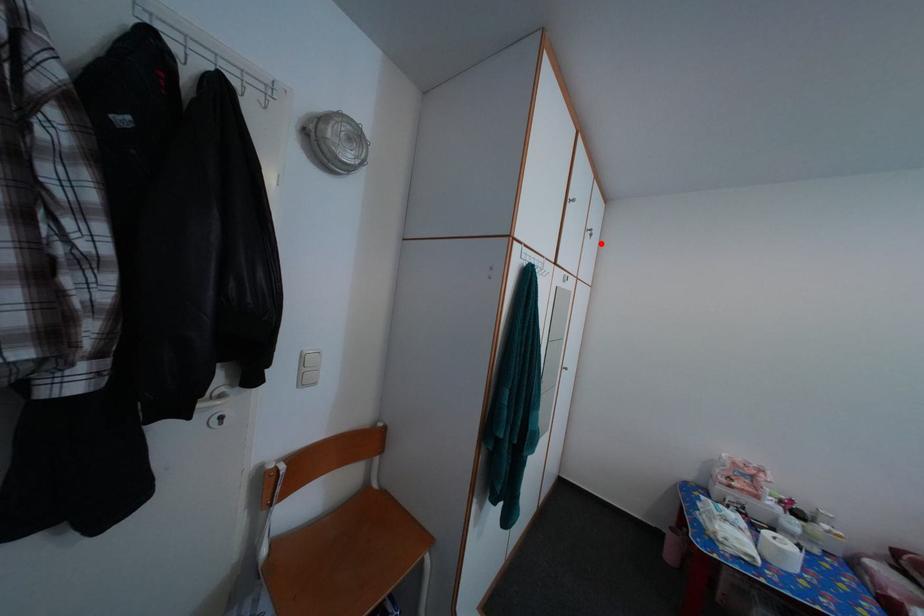
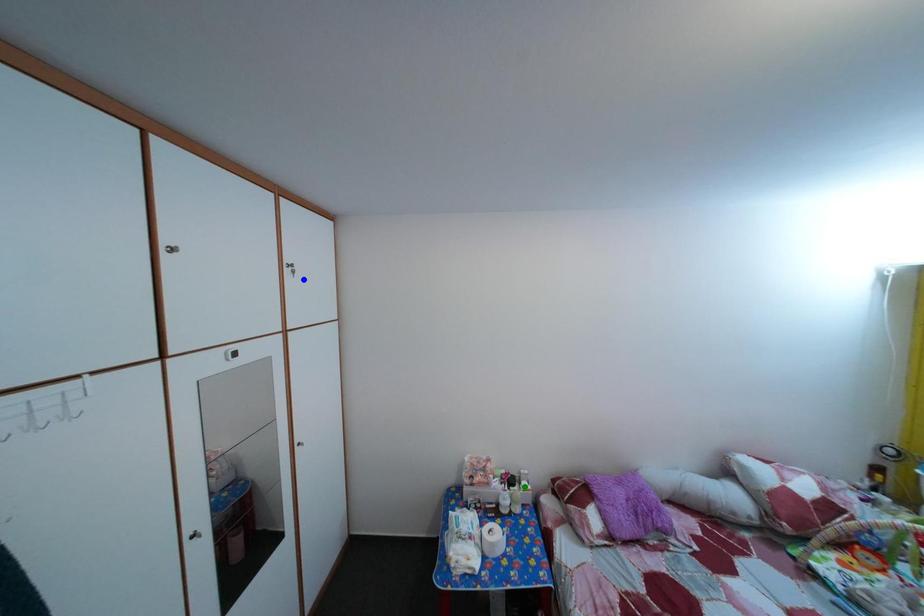
Question: I am providing you with two images of the same scene from different viewpoints. A red point is marked on the first image. You are given multiple points on the second image. Which mark in image 2 goes with the point in image 1?

Choices:
 (A) yellow point
 (B) green point
 (C) blue point

Answer: (C)